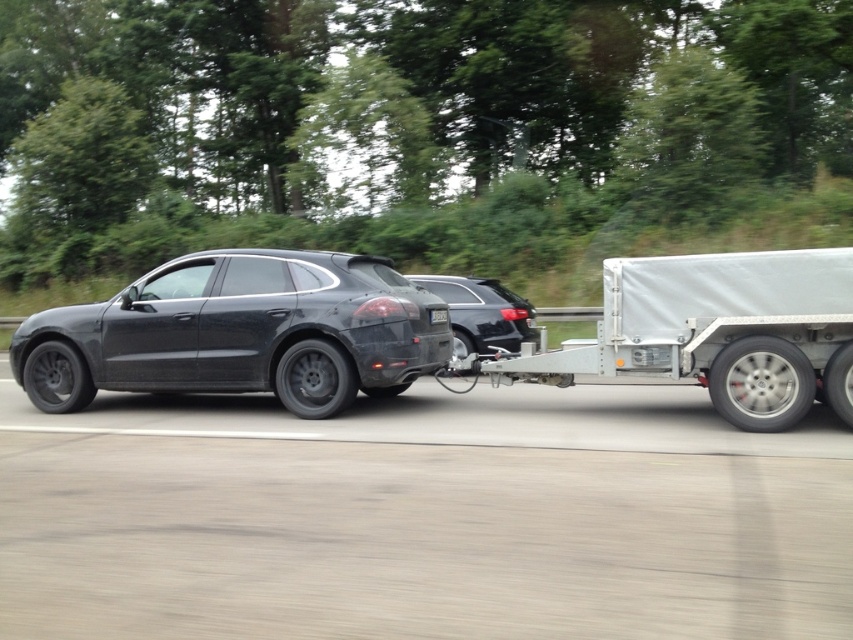
You are a delivery driver who needs to park your vehicle in a parking spot that can only accommodate cars up to the size of the satin black car at center. You have a matte black suv at left. Can your vehicle fit in the parking spot?

The matte black suv at left is wider than the satin black car at center, so it cannot fit in the parking spot designated for cars up to the size of the satin black car at center.

From the picture: You are standing at the point labeled as point (498, 308) and want to walk towards the camera. Which direction should you move to get closer to the camera without moving past point (700, 276)?

You should move towards point (700, 276) because it is closer to the camera than point (498, 308). Moving toward that point will bring you closer to the camera without passing it.

You are standing at the point labeled point (28, 349) and want to walk towards the point labeled point (494, 298). Based on the scene, will you be moving towards the background or towards the foreground?

Since point (28, 349) is closer to the viewer than point (494, 298), moving from the former to the latter would mean moving towards the background.